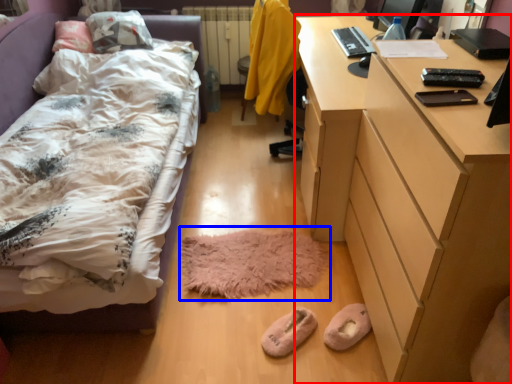
Question: Which point is further to the camera, desk (highlighted by a red box) or mat (highlighted by a blue box)?

Choices:
 (A) desk
 (B) mat

Answer: (B)